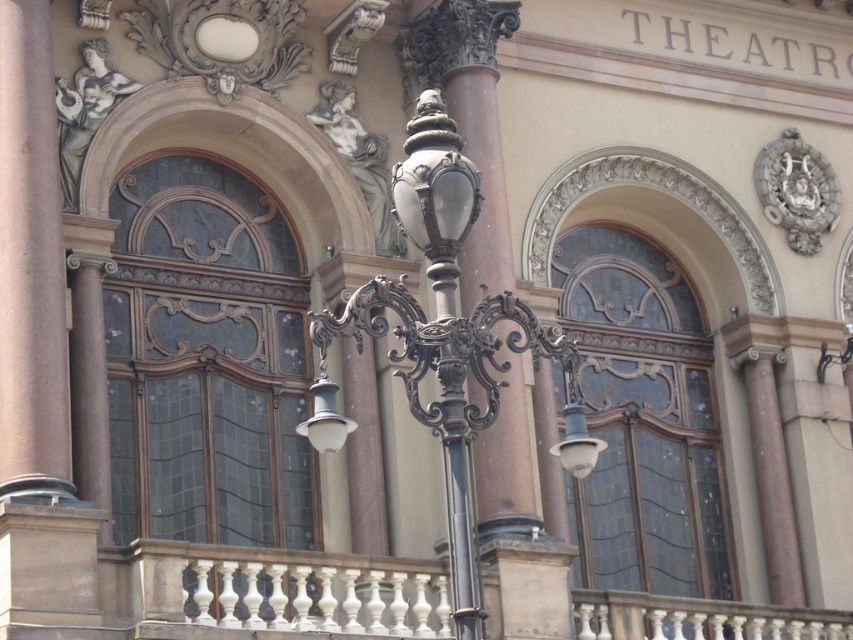
Based on the photo, you are a city planner assessing the spacing between the polished bronze streetlight at center and the smooth pink stone column at left. According to safety regulations, the minimum distance required between such fixtures is 10 meters. Does this spacing meet the requirement?

The distance between the polished bronze streetlight at center and the smooth pink stone column at left is 10.30 meters, which exceeds the minimum required 10 meters, so it meets the safety regulations.

You are standing in front of the theater facade and notice the polished bronze streetlight at center and the smooth pink stone column at left. Which object is positioned higher up on the building?

The smooth pink stone column at left is positioned higher up on the building than the polished bronze streetlight at center.